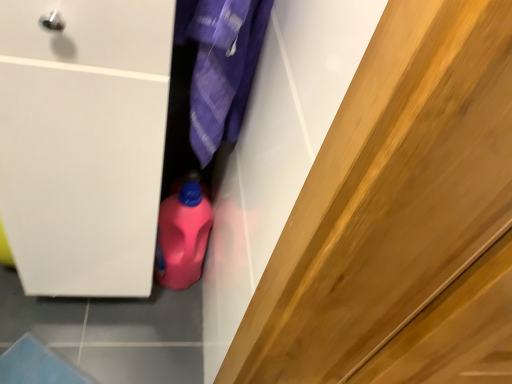
Question: Is pink plastic bottle at center to the right of purple fabric at center from the viewer's perspective?

Choices:
 (A) yes
 (B) no

Answer: (B)

Question: Does pink plastic bottle at center have a smaller size compared to purple fabric at center?

Choices:
 (A) yes
 (B) no

Answer: (A)

Question: Is pink plastic bottle at center taller than purple fabric at center?

Choices:
 (A) no
 (B) yes

Answer: (A)

Question: From the image's perspective, is pink plastic bottle at center located above purple fabric at center?

Choices:
 (A) yes
 (B) no

Answer: (B)

Question: Is pink plastic bottle at center oriented away from purple fabric at center?

Choices:
 (A) yes
 (B) no

Answer: (B)

Question: From the image's perspective, is pink plastic bottle at center beneath purple fabric at center?

Choices:
 (A) no
 (B) yes

Answer: (B)

Question: Is purple fabric at center located outside pink plastic bottle at center?

Choices:
 (A) yes
 (B) no

Answer: (A)

Question: Is purple fabric at center to the right of pink plastic bottle at center from the viewer's perspective?

Choices:
 (A) yes
 (B) no

Answer: (A)

Question: Is purple fabric at center oriented away from pink plastic bottle at center?

Choices:
 (A) yes
 (B) no

Answer: (B)

Question: Is purple fabric at center taller than pink plastic bottle at center?

Choices:
 (A) yes
 (B) no

Answer: (A)

Question: Is purple fabric at center in front of pink plastic bottle at center?

Choices:
 (A) yes
 (B) no

Answer: (A)

Question: From a real-world perspective, is purple fabric at center located higher than pink plastic bottle at center?

Choices:
 (A) yes
 (B) no

Answer: (A)

Question: From the image's perspective, relative to pink plastic bottle at center, is purple fabric at center above or below?

Choices:
 (A) below
 (B) above

Answer: (B)